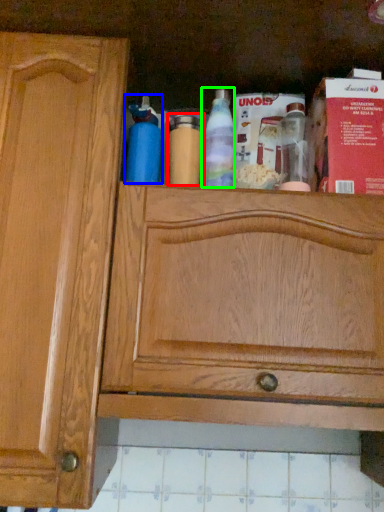
Question: Which object is the farthest from bottle (highlighted by a red box)? Choose among these: bottle (highlighted by a blue box) or bottle (highlighted by a green box).

Choices:
 (A) bottle
 (B) bottle

Answer: (A)